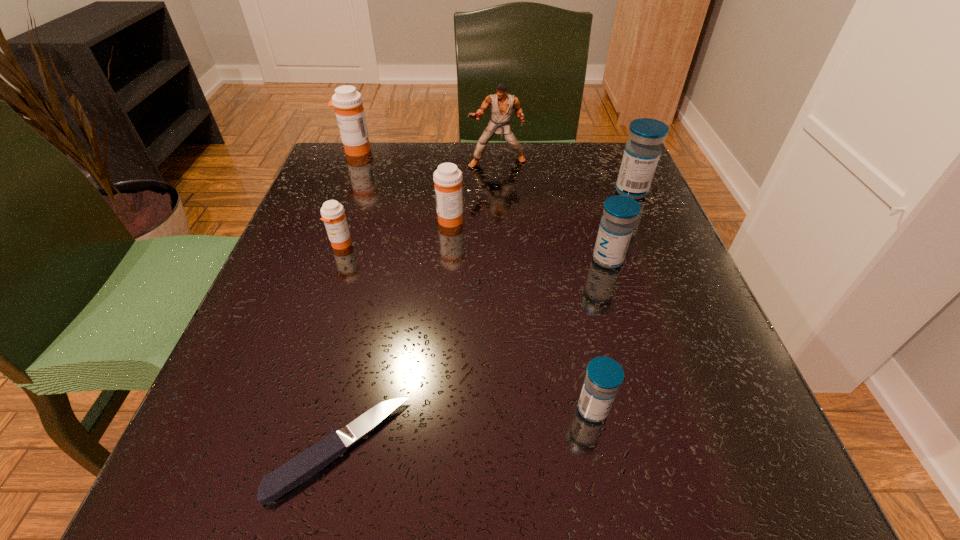
Locate an element on the screen. This screenshot has height=540, width=960. vacant space that is in between the rightmost blue medicine and the smallest orange medicine is located at coordinates 487,218.

What are the coordinates of `blank region between the rightmost object and the fifth nearest object` in the screenshot? It's located at (540, 205).

Locate an element on the screen. vacant region between the fourth medicine from left to right and the fourth object from left to right is located at coordinates (521, 314).

Where is `vacant area that lies between the fourth medicine from right to left and the fifth object from left to right`? Image resolution: width=960 pixels, height=540 pixels. vacant area that lies between the fourth medicine from right to left and the fifth object from left to right is located at coordinates (473, 191).

Where is `object that is the fourth nearest to the smallest blue medicine`? object that is the fourth nearest to the smallest blue medicine is located at coordinates (641, 155).

Select which object is the fourth closest to the fifth medicine from left to right. Please provide its 2D coordinates. Your answer should be formatted as a tuple, i.e. [(x, y)], where the tuple contains the x and y coordinates of a point satisfying the conditions above.

[(502, 103)]

Locate an element on the screen. The height and width of the screenshot is (540, 960). medicine object that ranks as the fifth closest to the puncher is located at coordinates (332, 212).

Point out which medicine is positioned as the second nearest to the farthest orange medicine. Please provide its 2D coordinates. Your answer should be formatted as a tuple, i.e. [(x, y)], where the tuple contains the x and y coordinates of a point satisfying the conditions above.

[(332, 212)]

Locate an element on the screen. This screenshot has width=960, height=540. orange medicine that is the third closest one to the second smallest blue medicine is located at coordinates (349, 110).

Locate an element on the screen. The width and height of the screenshot is (960, 540). the closest orange medicine relative to the farthest orange medicine is located at coordinates (448, 178).